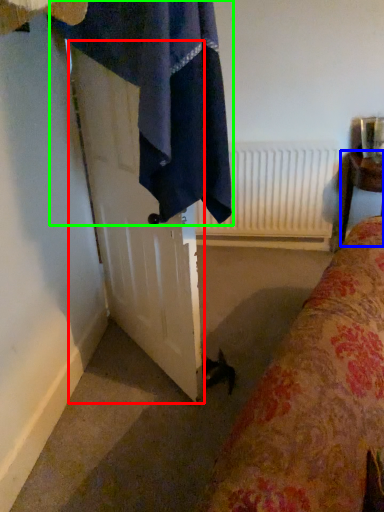
Question: Which is farther away from screen door (highlighted by a red box)? furniture (highlighted by a blue box) or bath towel (highlighted by a green box)?

Choices:
 (A) furniture
 (B) bath towel

Answer: (A)